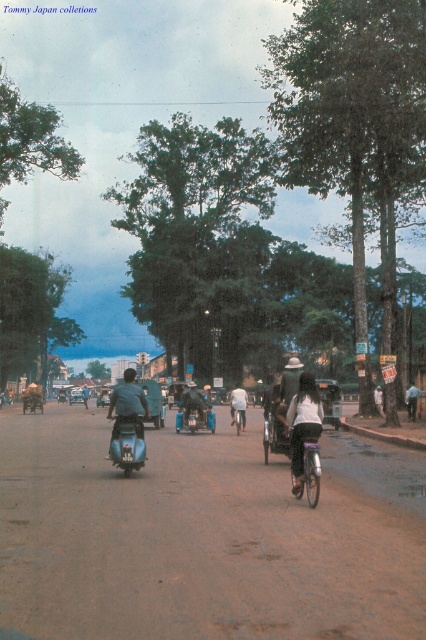
You are a pedestrian standing on the side of the road in the scene. You see a blue metallic motorcycle at center and a light blue fabric shirt at center. Which object is closer to your left side?

The blue metallic motorcycle at center is positioned on the left side of light blue fabric shirt at center, so it is closer to your left side.

You are a delivery person who needs to quickly pass through the street. You see a white matte bicycle at center and a shiny blue bicycle at center. Which bicycle should you move out of the way first?

The white matte bicycle at center is in front of the shiny blue bicycle at center, so you should move the white matte bicycle at center first to clear the path.

You are a pedestrian standing on the road and see the blue metallic motorcycle at center and the light blue fabric shirt at center. Which object is higher from the ground?

The blue metallic motorcycle at center is above light blue fabric shirt at center, so the blue metallic motorcycle at center is higher from the ground.